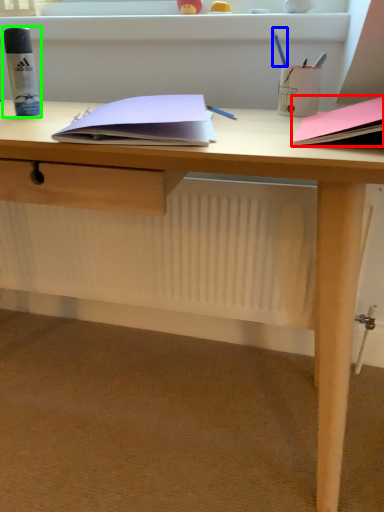
Question: Which object is positioned farthest from paperback book (highlighted by a red box)? Select from stationery (highlighted by a blue box) and stationery (highlighted by a green box).

Choices:
 (A) stationery
 (B) stationery

Answer: (B)